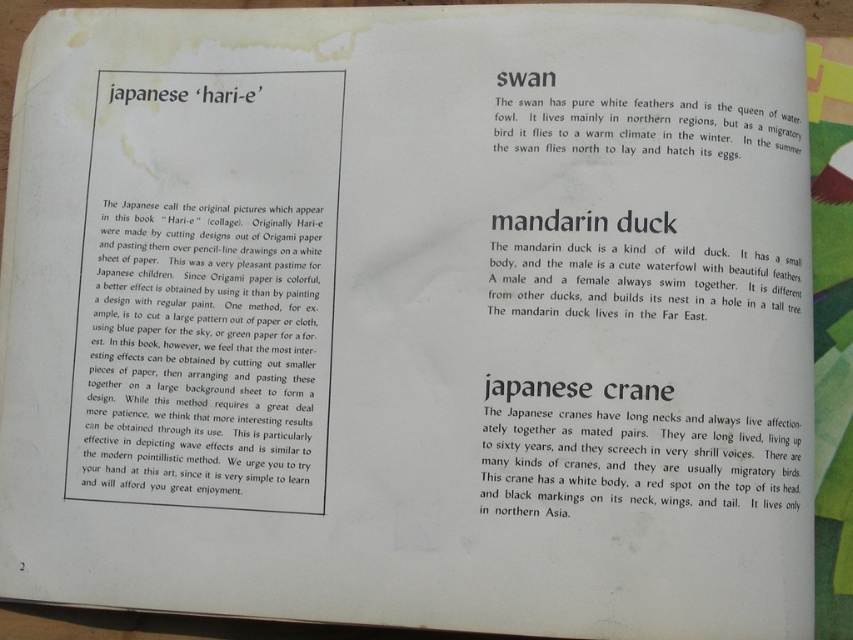
Question: Which point is closer to the camera?

Choices:
 (A) white paper at upper left
 (B) white feathered swan at upper right

Answer: (A)

Question: Which of the following is the farthest from the observer?

Choices:
 (A) (186, 355)
 (B) (746, 109)

Answer: (A)

Question: Can you confirm if white paper at upper left is positioned to the left of white feathered swan at upper right?

Choices:
 (A) no
 (B) yes

Answer: (B)

Question: Which point appears farthest from the camera in this image?

Choices:
 (A) (798, 148)
 (B) (235, 451)

Answer: (A)

Question: Does white paper at upper left appear under white feathered swan at upper right?

Choices:
 (A) no
 (B) yes

Answer: (B)

Question: Does white paper at upper left appear under white feathered swan at upper right?

Choices:
 (A) no
 (B) yes

Answer: (B)